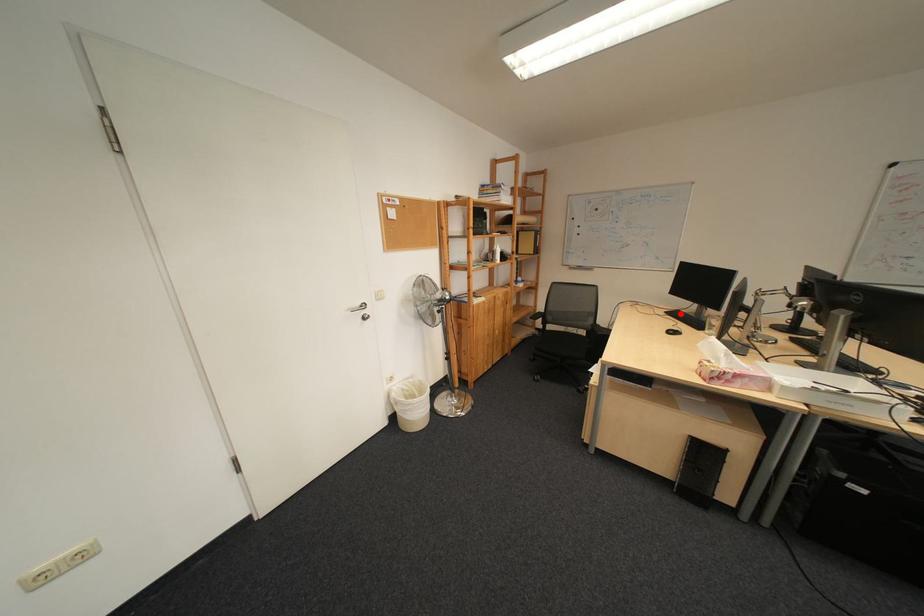
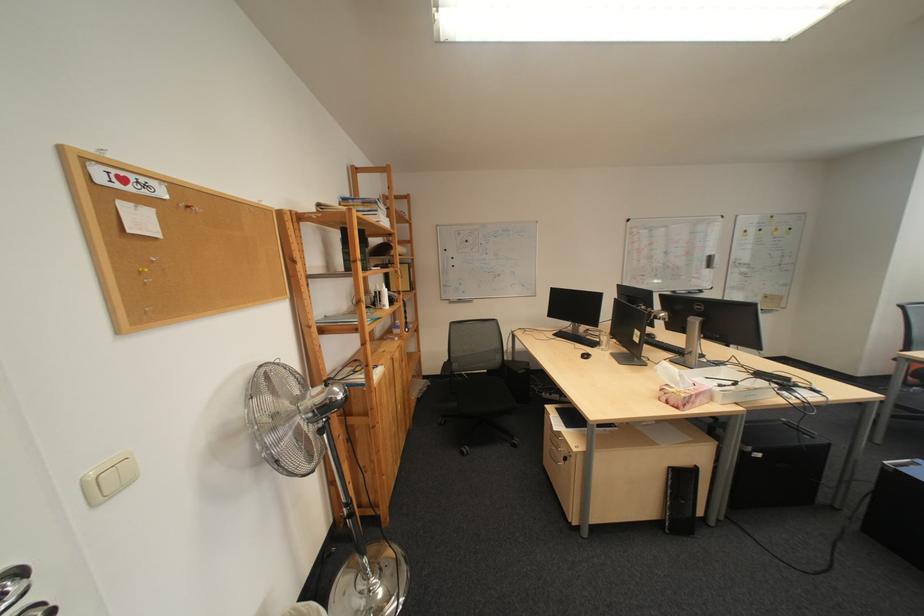
In the second image, find the point that corresponds to the highlighted location in the first image.

(568, 336)